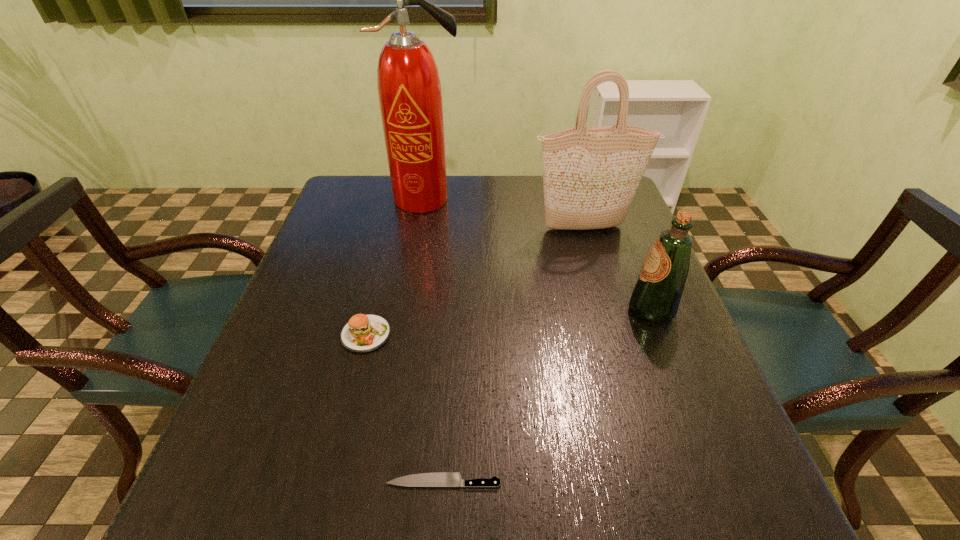
Where is `vacant space at the far edge of the desktop`? The width and height of the screenshot is (960, 540). vacant space at the far edge of the desktop is located at coordinates (518, 174).

Locate an element on the screen. vacant area at the near edge of the desktop is located at coordinates (338, 477).

Identify the location of free space at the left edge of the desktop. (280, 330).

What are the coordinates of `vacant space at the right edge of the desktop` in the screenshot? It's located at (600, 241).

Locate an element on the screen. Image resolution: width=960 pixels, height=540 pixels. vacant space at the near left corner is located at coordinates (234, 524).

You are a GUI agent. You are given a task and a screenshot of the screen. Output one action in this format:
    pyautogui.click(x=<x>, y=<y>)
    Task: Click on the vacant space at the near right corner of the desktop
    The height and width of the screenshot is (540, 960).
    Given the screenshot: What is the action you would take?
    [684, 487]

Identify the location of free space between the shopping bag and the farthest object. (505, 214).

Locate an element on the screen. This screenshot has height=540, width=960. free spot between the fire extinguisher and the shopping bag is located at coordinates (505, 214).

You are a GUI agent. You are given a task and a screenshot of the screen. Output one action in this format:
    pyautogui.click(x=<x>, y=<y>)
    Task: Click on the free space that is in between the shopping bag and the third tallest object
    This screenshot has width=960, height=540.
    Given the screenshot: What is the action you would take?
    pyautogui.click(x=618, y=268)

This screenshot has height=540, width=960. I want to click on blank region between the shortest object and the fire extinguisher, so click(434, 340).